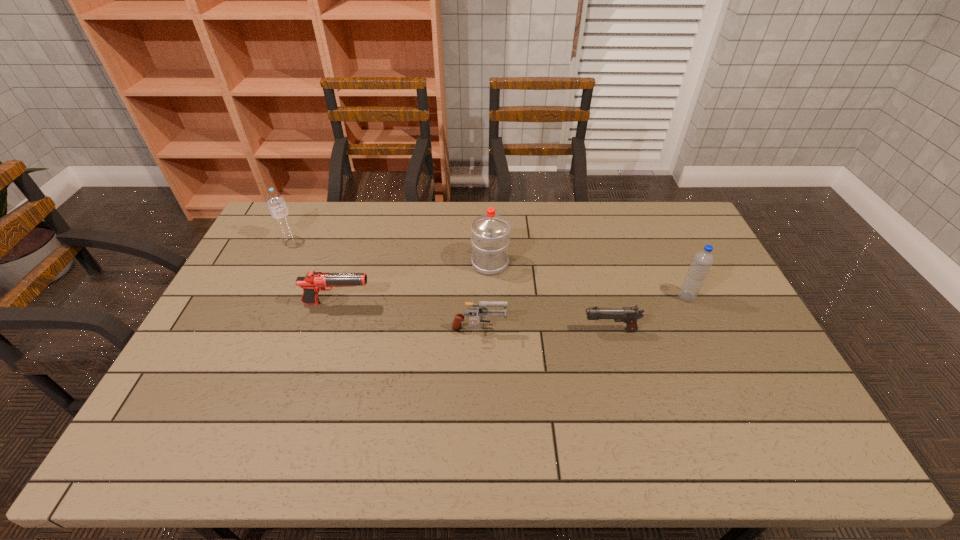
Locate an element on the screen. Image resolution: width=960 pixels, height=540 pixels. vacant region between the second object from right to left and the fifth nearest object is located at coordinates (550, 297).

Locate an element on the screen. The image size is (960, 540). vacant area that lies between the leftmost gun and the second gun from right to left is located at coordinates 408,318.

Where is `free space between the second object from right to left and the second object from left to right`? Image resolution: width=960 pixels, height=540 pixels. free space between the second object from right to left and the second object from left to right is located at coordinates tap(473, 317).

At what (x,y) coordinates should I click in order to perform the action: click on free area in between the second object from right to left and the second gun from left to right. Please return your answer as a coordinate pair (x, y). Looking at the image, I should click on (544, 331).

Image resolution: width=960 pixels, height=540 pixels. In order to click on vacant space that is in between the rightmost water bottle and the rightmost gun in this screenshot , I will do (648, 314).

I want to click on free space between the farthest gun and the second object from right to left, so click(x=473, y=317).

Where is `free spot between the farthest object and the second gun from left to right`? The height and width of the screenshot is (540, 960). free spot between the farthest object and the second gun from left to right is located at coordinates (385, 286).

This screenshot has width=960, height=540. Find the location of `unoccupied position between the nearest water bottle and the farthest gun`. unoccupied position between the nearest water bottle and the farthest gun is located at coordinates (512, 300).

Find the location of a particular element. blank region between the rightmost object and the second water bottle from right to left is located at coordinates (588, 280).

The height and width of the screenshot is (540, 960). I want to click on unoccupied position between the farthest gun and the rightmost object, so click(512, 300).